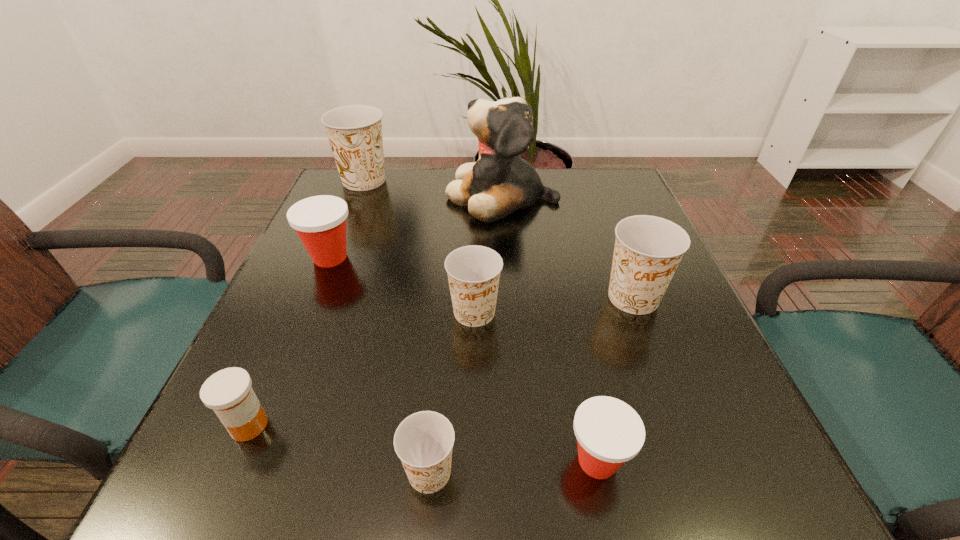
Image resolution: width=960 pixels, height=540 pixels. I want to click on free space that satisfies the following two spatial constraints: 1. on the front side of the fifth shortest Dixie cup; 2. on the left side of the leftmost orange Dixie cup, so click(x=317, y=298).

Image resolution: width=960 pixels, height=540 pixels. I want to click on blank area in the image that satisfies the following two spatial constraints: 1. on the back side of the nearer red-orange Dixie cup; 2. on the label of the orange medicine, so click(590, 425).

I want to click on vacant space that satisfies the following two spatial constraints: 1. on the label of the smaller red-orange Dixie cup; 2. on the left side of the medicine, so click(x=233, y=461).

You are a GUI agent. You are given a task and a screenshot of the screen. Output one action in this format:
    pyautogui.click(x=<x>, y=<y>)
    Task: Click on the free space that satisfies the following two spatial constraints: 1. on the label of the fifth Dixie cup from left to right; 2. on the right side of the orange medicine
    The width and height of the screenshot is (960, 540).
    Given the screenshot: What is the action you would take?
    pyautogui.click(x=233, y=461)